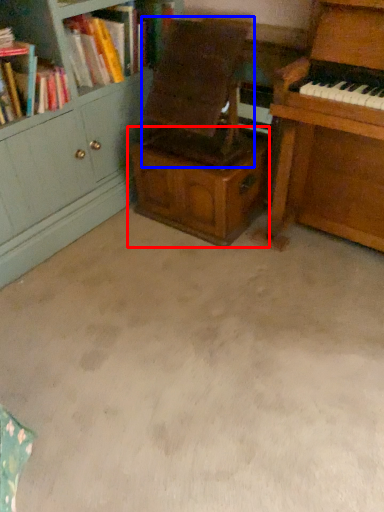
Question: Which point is further to the camera, cabinetry (highlighted by a red box) or armchair (highlighted by a blue box)?

Choices:
 (A) cabinetry
 (B) armchair

Answer: (A)